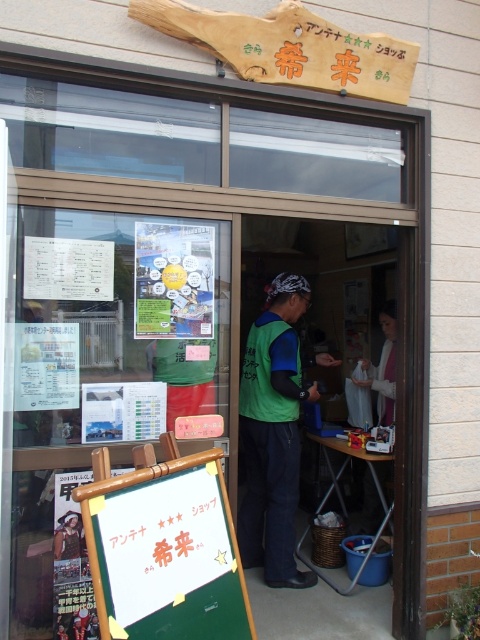
Question: Estimate the real-world distances between objects in this image. Which object is closer to the green chalkboard at lower left?

Choices:
 (A) green fabric vest at center
 (B) white cotton shirt at center

Answer: (A)

Question: Which is nearer to the green fabric vest at center?

Choices:
 (A) green chalkboard at lower left
 (B) white cotton shirt at center

Answer: (B)

Question: Is green chalkboard at lower left bigger than white cotton shirt at center?

Choices:
 (A) yes
 (B) no

Answer: (A)

Question: Does green fabric vest at center appear on the right side of white cotton shirt at center?

Choices:
 (A) no
 (B) yes

Answer: (A)

Question: Can you confirm if green chalkboard at lower left is positioned below white cotton shirt at center?

Choices:
 (A) no
 (B) yes

Answer: (B)

Question: Which point appears closest to the camera in this image?

Choices:
 (A) coord(292,362)
 (B) coord(381,388)
 (C) coord(132,488)

Answer: (C)